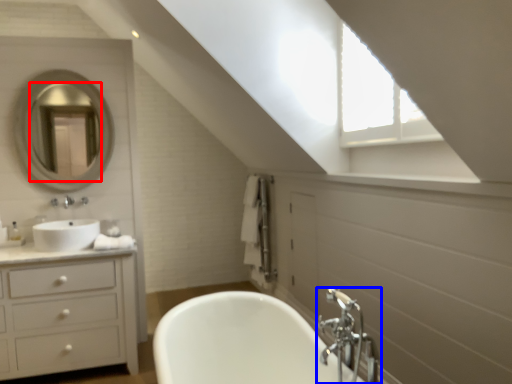
Question: Which object is closer to the camera taking this photo, mirror (highlighted by a red box) or tap (highlighted by a blue box)?

Choices:
 (A) mirror
 (B) tap

Answer: (B)